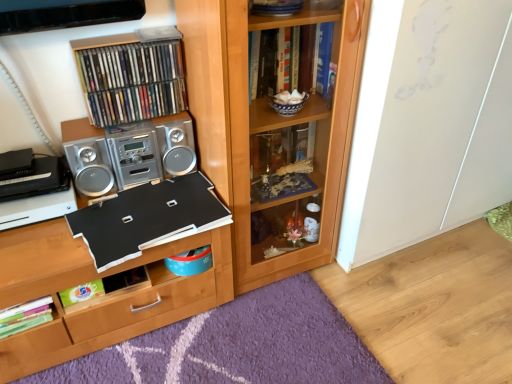
Find the location of a particular element. The image size is (512, 384). vacant point above black matte board at center (from a real-world perspective) is located at coordinates (94, 218).